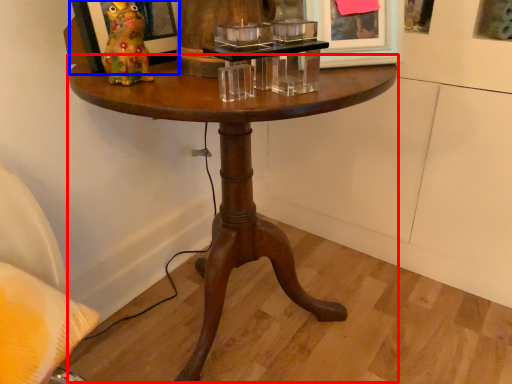
Question: Which of the following is the farthest to the observer, coffee table (highlighted by a red box) or picture frame (highlighted by a blue box)?

Choices:
 (A) coffee table
 (B) picture frame

Answer: (B)